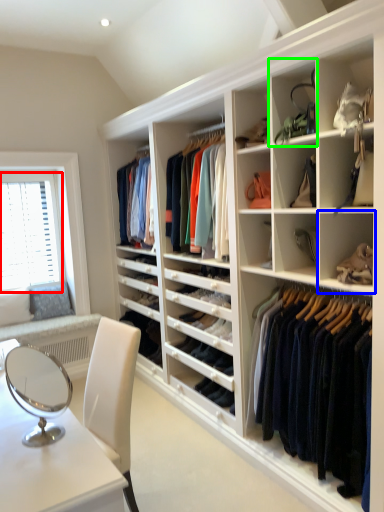
Question: Considering the real-world distances, which object is farthest from window screen (highlighted by a red box)? shelf (highlighted by a blue box) or shelf (highlighted by a green box)?

Choices:
 (A) shelf
 (B) shelf

Answer: (A)